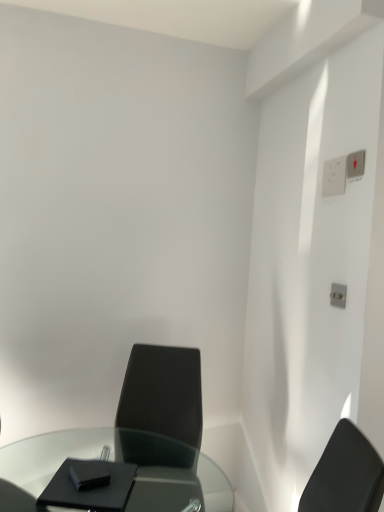
Question: Can you confirm if transparent glass table at lower left is wider than matte black chair at center?

Choices:
 (A) yes
 (B) no

Answer: (A)

Question: Are transparent glass table at lower left and matte black chair at center far apart?

Choices:
 (A) no
 (B) yes

Answer: (A)

Question: From the image's perspective, would you say transparent glass table at lower left is positioned over matte black chair at center?

Choices:
 (A) yes
 (B) no

Answer: (B)

Question: Is transparent glass table at lower left outside of matte black chair at center?

Choices:
 (A) yes
 (B) no

Answer: (A)

Question: Can you confirm if transparent glass table at lower left is smaller than matte black chair at center?

Choices:
 (A) yes
 (B) no

Answer: (B)

Question: Is transparent glass table at lower left next to matte black chair at center?

Choices:
 (A) yes
 (B) no

Answer: (B)

Question: Does matte black chair at center have a lesser height compared to transparent glass table at lower left?

Choices:
 (A) no
 (B) yes

Answer: (A)

Question: Is matte black chair at center facing towards transparent glass table at lower left?

Choices:
 (A) yes
 (B) no

Answer: (A)

Question: Is matte black chair at center further to the viewer compared to transparent glass table at lower left?

Choices:
 (A) yes
 (B) no

Answer: (A)

Question: Considering the relative sizes of matte black chair at center and transparent glass table at lower left in the image provided, is matte black chair at center taller than transparent glass table at lower left?

Choices:
 (A) no
 (B) yes

Answer: (B)

Question: Is matte black chair at center at the right side of transparent glass table at lower left?

Choices:
 (A) no
 (B) yes

Answer: (B)

Question: Can you confirm if matte black chair at center is smaller than transparent glass table at lower left?

Choices:
 (A) yes
 (B) no

Answer: (A)

Question: From a real-world perspective, is white plastic switch at upper right, the 1th electric outlet positioned from the front, located higher than transparent glass table at lower left?

Choices:
 (A) no
 (B) yes

Answer: (B)